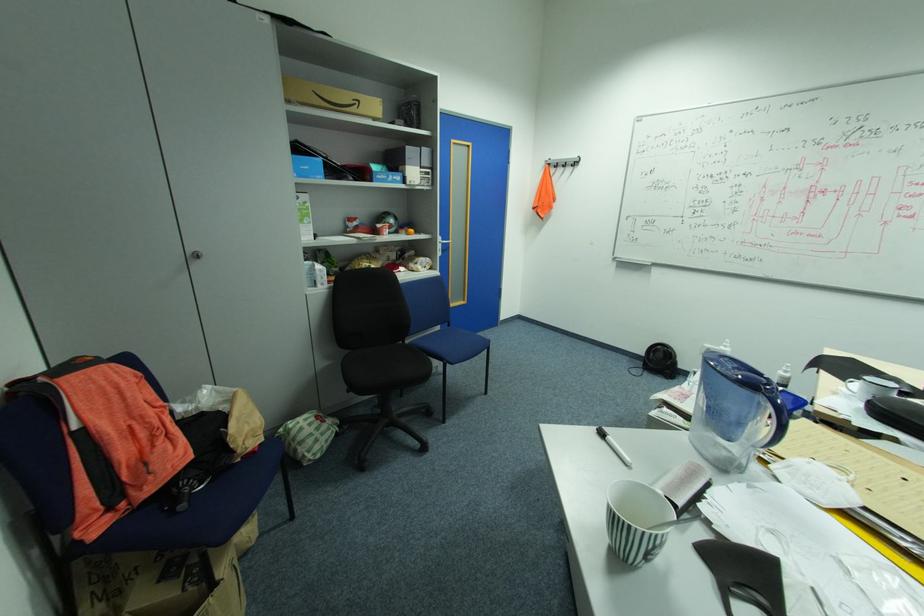
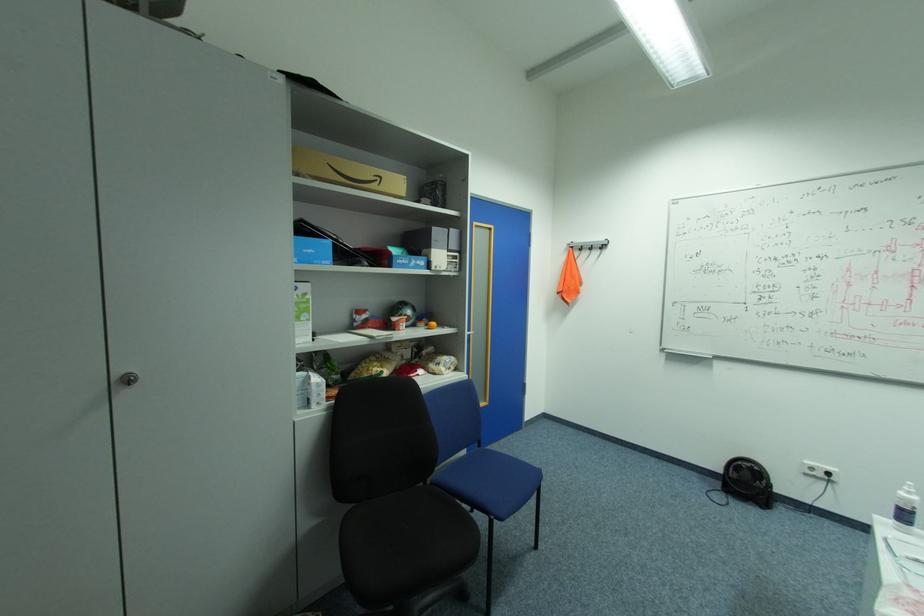
The point at (391, 223) is marked in the first image. Where is the corresponding point in the second image?

(407, 315)